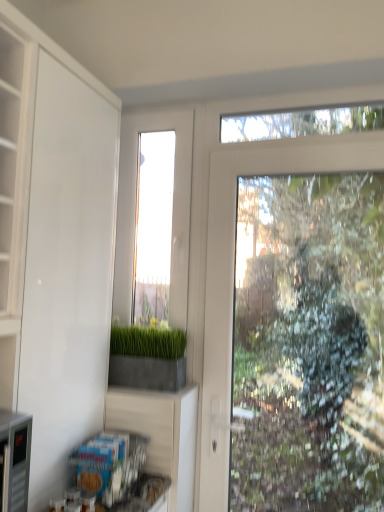
Question: Considering the positions of white matte cabinet at left and concrete planter at center in the image, is white matte cabinet at left bigger or smaller than concrete planter at center?

Choices:
 (A) small
 (B) big

Answer: (B)

Question: In the image, is white matte cabinet at left on the left side or the right side of concrete planter at center?

Choices:
 (A) right
 (B) left

Answer: (B)

Question: Considering the real-world distances, which object is closest to the concrete planter at center?

Choices:
 (A) white matte cabinet at left
 (B) clear glass window at center

Answer: (B)

Question: Estimate the real-world distances between objects in this image. Which object is closer to the white matte cabinet at left?

Choices:
 (A) concrete planter at center
 (B) clear glass window at center

Answer: (A)